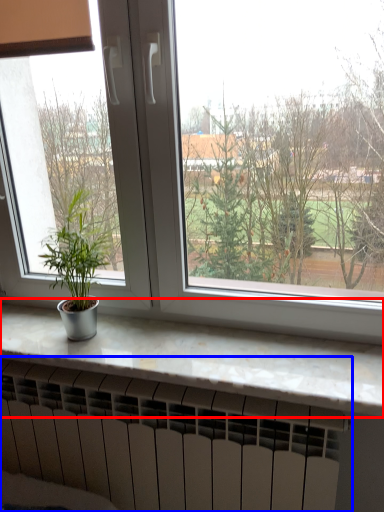
Question: Among these objects, which one is farthest to the camera, counter top (highlighted by a red box) or heater (highlighted by a blue box)?

Choices:
 (A) counter top
 (B) heater

Answer: (B)